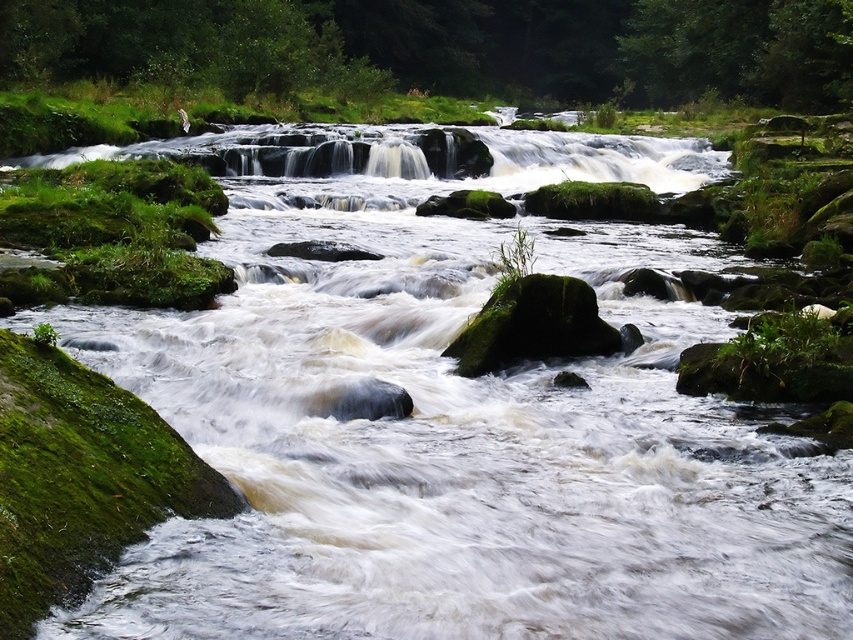
You are standing at the edge of the river and see two points marked in the scene. Which point is closer to you, point (9, 49) or point (550, 310)?

Point (9, 49) is closer to you because it is further to the viewer than point (550, 310).